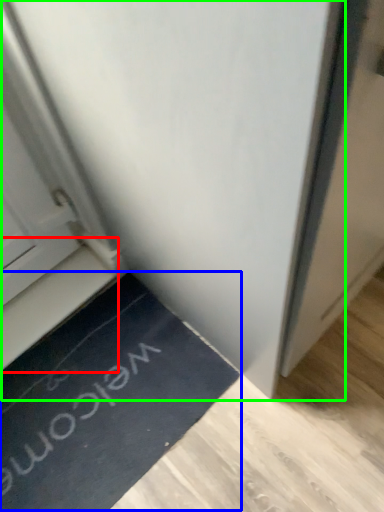
Question: Which object is positioned farthest from stairwell (highlighted by a red box)? Select from doormat (highlighted by a blue box) and door (highlighted by a green box).

Choices:
 (A) doormat
 (B) door

Answer: (B)